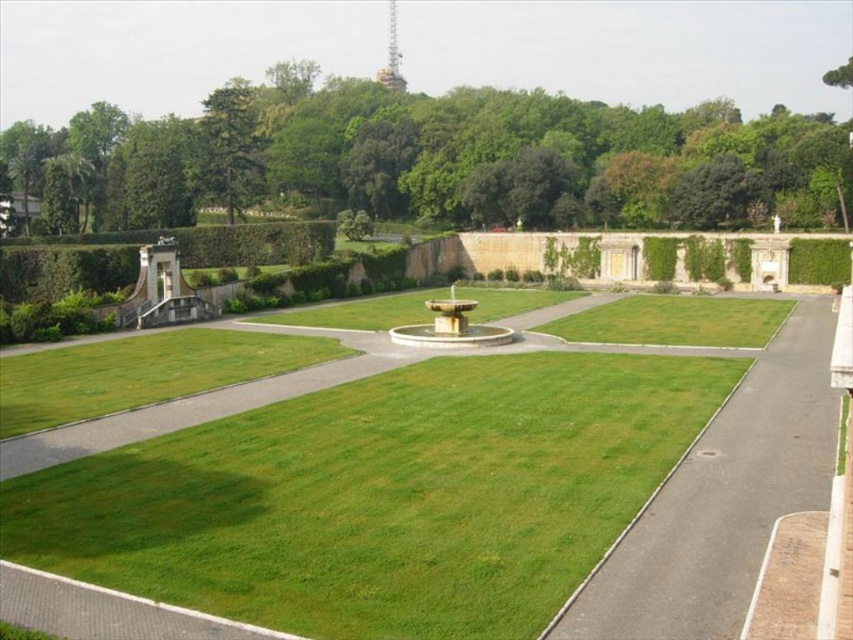
You are standing at the center of the garden looking towards the fountain. Where would you see the green leafy tree at upper center in relation to your current position?

The green leafy tree at upper center is located at coordinates approximately 0.248 on the x axis and 0.553 on the y axis relative to your position at the center of the garden.

Based on the photo, in the garden scene, there is a green leafy tree at upper center represented by the point (471, 157). Where is this point located in the image?

The point (471, 157) corresponds to the green leafy tree at upper center in the image.

You are standing at the center of the garden and want to locate the green leafy tree at upper left. Based on the garden layout, in which direction should you look to find it?

The green leafy tree at upper left is located at point (229, 147), so you should look towards the upper left direction from the center of the garden.